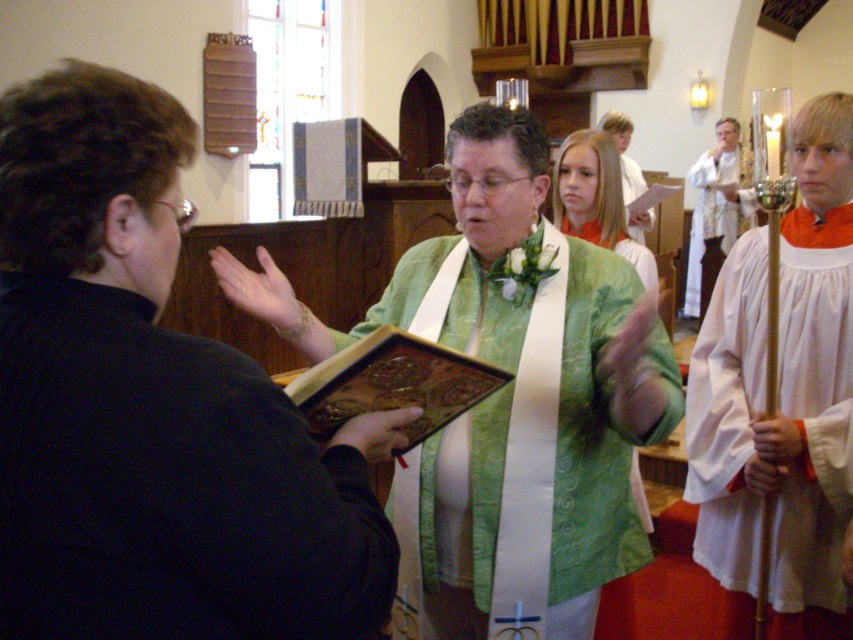
Question: Which point is farther to the camera?

Choices:
 (A) white silk robe at upper right
 (B) green satin robe at center
 (C) white satin robe at upper center
 (D) green textured fabric at center

Answer: (A)

Question: Which object is farther from the camera taking this photo?

Choices:
 (A) white cotton robe at right
 (B) green silk robe at center
 (C) green satin robe at center
 (D) white satin robe at upper center

Answer: (D)

Question: Estimate the real-world distances between objects in this image. Which object is closer to the green satin robe at center?

Choices:
 (A) green textured vest at center
 (B) white silk robe at upper right

Answer: (A)

Question: Where is green satin robe at center located in relation to green silk robe at center in the image?

Choices:
 (A) above
 (B) below

Answer: (B)

Question: Is white cotton robe at right bigger than green textured vest at center?

Choices:
 (A) yes
 (B) no

Answer: (B)

Question: Is white silk robe at upper right wider than green silk robe at center?

Choices:
 (A) no
 (B) yes

Answer: (B)